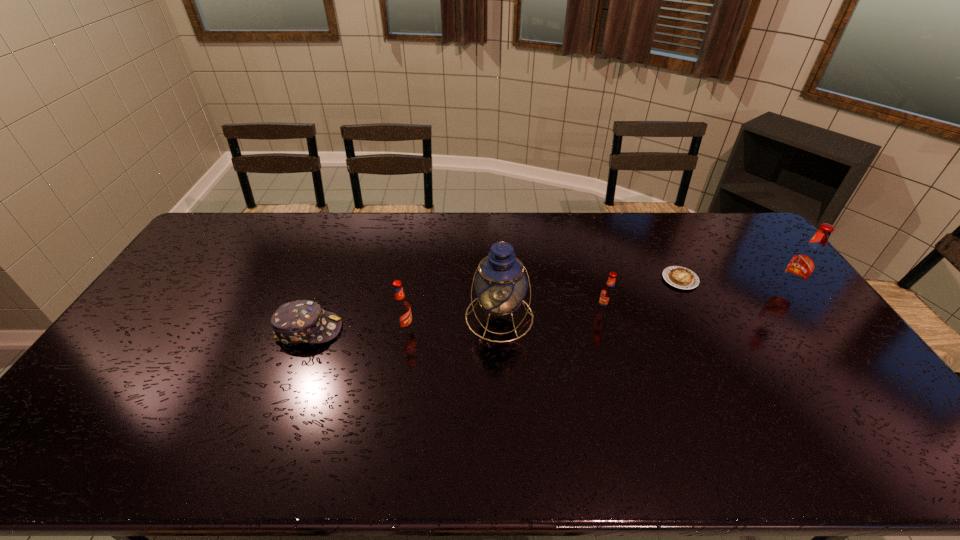
This screenshot has height=540, width=960. I want to click on vacant space at the left edge of the desktop, so click(x=214, y=273).

Identify the location of vacant space at the far left corner. (241, 242).

The height and width of the screenshot is (540, 960). Find the location of `empty location between the fifth object from right to left and the third object from left to right`. empty location between the fifth object from right to left and the third object from left to right is located at coordinates (452, 323).

At what (x,y) coordinates should I click in order to perform the action: click on vacant space that's between the second object from right to left and the nearest root beer. Please return your answer as a coordinate pair (x, y). Image resolution: width=960 pixels, height=540 pixels. Looking at the image, I should click on (542, 304).

Locate an element on the screen. free space between the fifth object from right to left and the second nearest root beer is located at coordinates (504, 319).

Image resolution: width=960 pixels, height=540 pixels. In order to click on blank region between the tallest root beer and the second farthest root beer in this screenshot , I will do `click(695, 301)`.

Where is `vacant space in between the rightmost root beer and the fourth object from left to right`? vacant space in between the rightmost root beer and the fourth object from left to right is located at coordinates (695, 301).

You are a GUI agent. You are given a task and a screenshot of the screen. Output one action in this format:
    pyautogui.click(x=<x>, y=<y>)
    Task: Click on the free area in between the quiche and the third tallest object
    
    Given the screenshot: What is the action you would take?
    pyautogui.click(x=542, y=304)

In order to click on vacant area that lies between the fifth object from right to left and the fifth object from left to right in this screenshot , I will do `click(542, 304)`.

This screenshot has height=540, width=960. What are the coordinates of `free space between the second root beer from right to left and the nearest root beer` in the screenshot? It's located at (504, 319).